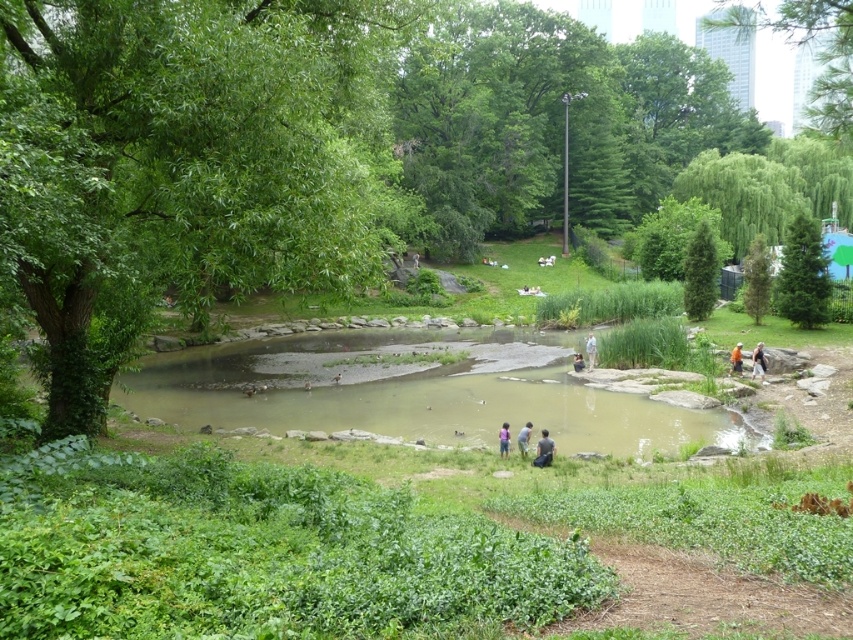
Question: Which object is the closest to the green matte tree at upper right?

Choices:
 (A) green mossy rocks at center
 (B) light blue shirt at center
 (C) light blue jeans at center

Answer: (C)

Question: Which of these objects is positioned closest to the green textured tree at upper right?

Choices:
 (A) dark gray fabric jacket at lower right
 (B) light brown leather jacket at center
 (C) dark blue jeans at center
 (D) green leafy tree at upper right

Answer: (C)

Question: Estimate the real-world distances between objects in this image. Which object is farther from the light blue jeans at center?

Choices:
 (A) dark gray fabric jacket at lower right
 (B) orange fabric at center

Answer: (A)

Question: Is green leafy tree at upper right wider than orange fabric at center?

Choices:
 (A) yes
 (B) no

Answer: (A)

Question: Considering the relative positions of light blue shirt at center and pink fabric at center in the image provided, where is light blue shirt at center located with respect to pink fabric at center?

Choices:
 (A) right
 (B) left

Answer: (A)

Question: Is green matte tree at upper right positioned behind green textured tree at upper right?

Choices:
 (A) yes
 (B) no

Answer: (B)